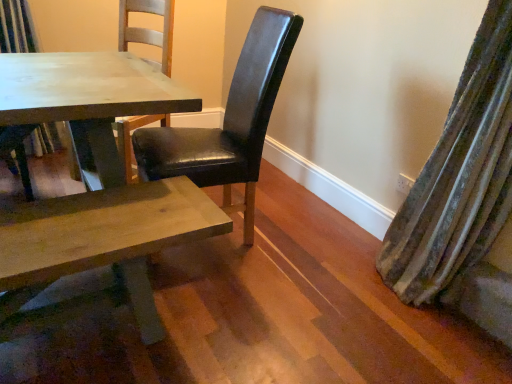
Question: Is black leather chair at center, which is the 1th chair from front to back, facing away from matte wooden table at center?

Choices:
 (A) yes
 (B) no

Answer: (B)

Question: Does black leather chair at center, the 1th chair viewed from the right, have a lesser height compared to matte wooden table at center?

Choices:
 (A) no
 (B) yes

Answer: (A)

Question: Is black leather chair at center, which is the 1th chair from front to back, closer to the viewer compared to matte wooden table at center?

Choices:
 (A) yes
 (B) no

Answer: (A)

Question: Is black leather chair at center, the 1th chair viewed from the right, far from matte wooden table at center?

Choices:
 (A) yes
 (B) no

Answer: (B)

Question: From a real-world perspective, does black leather chair at center, which is counted as the 2th chair, starting from the back, sit lower than matte wooden table at center?

Choices:
 (A) yes
 (B) no

Answer: (B)

Question: Does black leather chair at center, the 1th chair viewed from the right, have a greater height compared to matte wooden table at center?

Choices:
 (A) yes
 (B) no

Answer: (A)

Question: Is velvet green curtain at right positioned before matte wooden table at center?

Choices:
 (A) no
 (B) yes

Answer: (B)

Question: Is velvet green curtain at right facing away from matte wooden table at center?

Choices:
 (A) no
 (B) yes

Answer: (A)

Question: Does velvet green curtain at right have a greater height compared to matte wooden table at center?

Choices:
 (A) no
 (B) yes

Answer: (B)

Question: Can you confirm if velvet green curtain at right is bigger than matte wooden table at center?

Choices:
 (A) yes
 (B) no

Answer: (B)

Question: Is velvet green curtain at right aimed at matte wooden table at center?

Choices:
 (A) yes
 (B) no

Answer: (B)

Question: Is velvet green curtain at right to the left of matte wooden table at center from the viewer's perspective?

Choices:
 (A) yes
 (B) no

Answer: (B)

Question: Considering the relative sizes of matte wooden table at center and black leather chair at center, which is the 1th chair from front to back, in the image provided, is matte wooden table at center shorter than black leather chair at center, which is the 1th chair from front to back,?

Choices:
 (A) yes
 (B) no

Answer: (A)